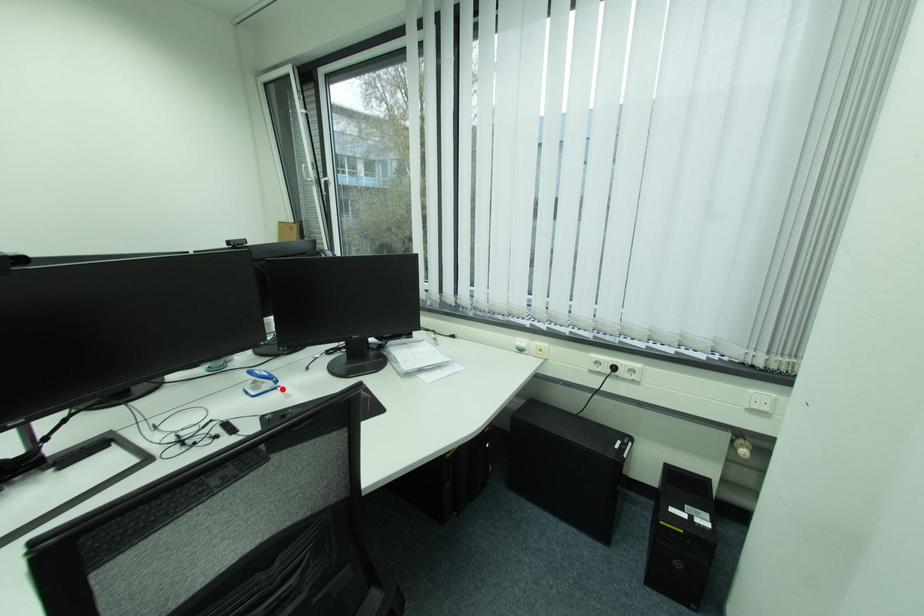
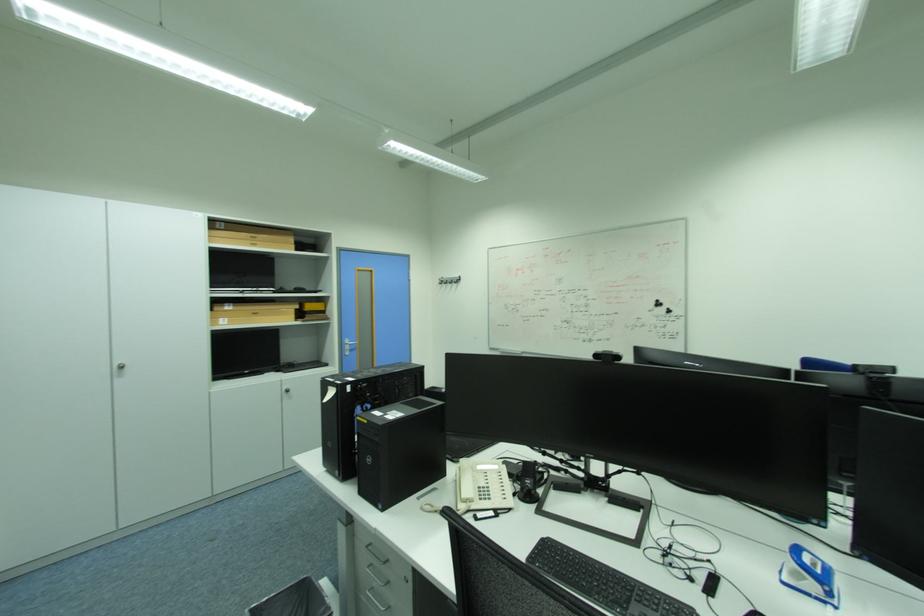
In the second image, find the point that corresponds to the highlighted location in the first image.

(833, 604)